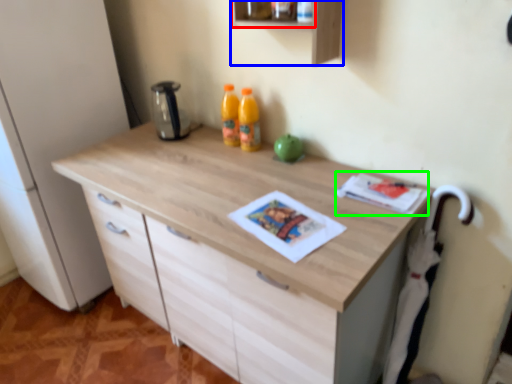
Question: Considering the real-world distances, which object is farthest from shelf (highlighted by a red box)? shelf (highlighted by a blue box) or magazine (highlighted by a green box)?

Choices:
 (A) shelf
 (B) magazine

Answer: (B)